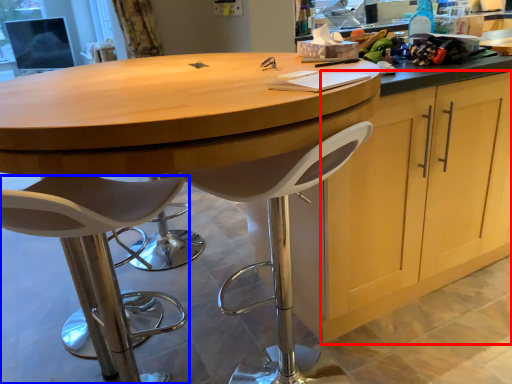
Question: Among these objects, which one is nearest to the camera, cabinetry (highlighted by a red box) or chair (highlighted by a blue box)?

Choices:
 (A) cabinetry
 (B) chair

Answer: (B)